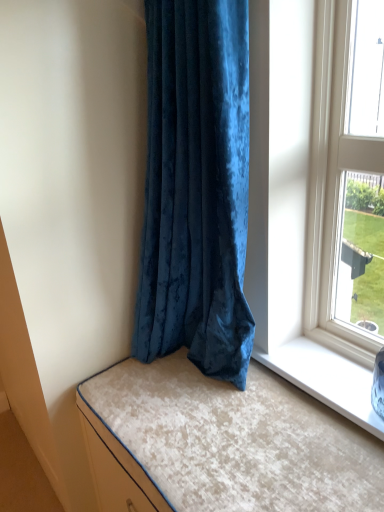
This screenshot has height=512, width=384. In order to click on free location to the left of velvet blue curtain at center in this screenshot , I will do `click(127, 386)`.